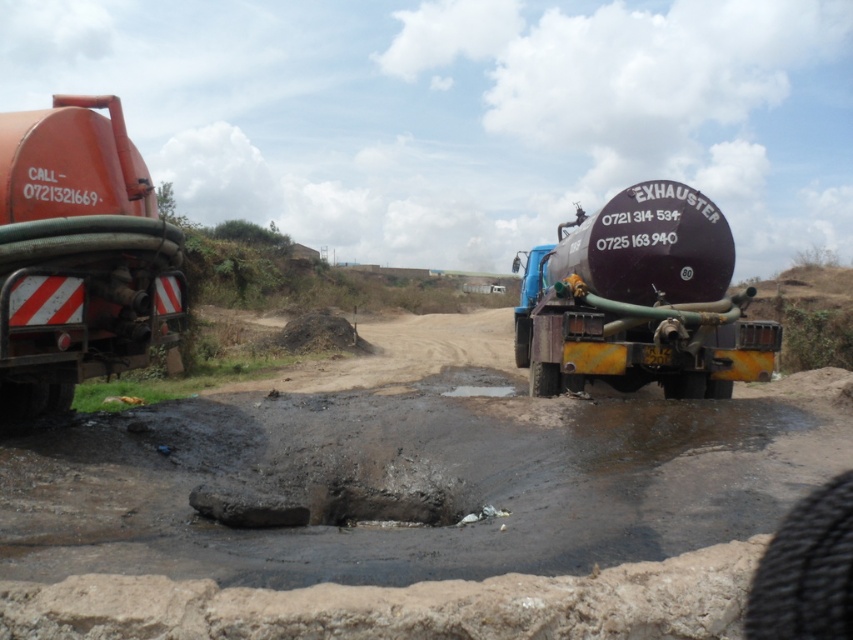
Question: Does matte orange tank at left have a larger size compared to matte black tank at center?

Choices:
 (A) no
 (B) yes

Answer: (A)

Question: Does smooth concrete at lower center appear over matte orange tank at left?

Choices:
 (A) yes
 (B) no

Answer: (B)

Question: Does matte orange tank at left have a larger size compared to black rubber puddle at center?

Choices:
 (A) no
 (B) yes

Answer: (A)

Question: Which of the following is the farthest from the observer?

Choices:
 (A) matte orange tank at left
 (B) matte black tank at center

Answer: (B)

Question: Which of the following is the closest to the observer?

Choices:
 (A) smooth concrete at lower center
 (B) matte black tank at center
 (C) matte orange tank at left

Answer: (A)

Question: Which object is farther from the camera taking this photo?

Choices:
 (A) matte orange tank at left
 (B) matte black tank at center

Answer: (B)